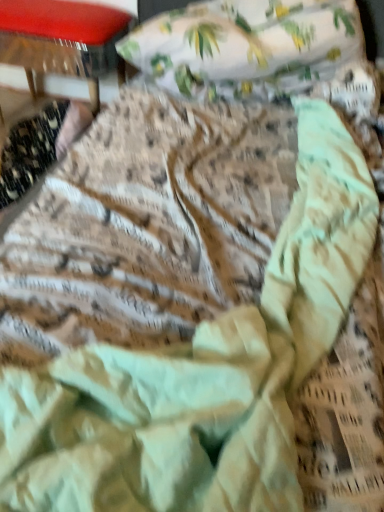
Describe the element at coordinates (61, 36) in the screenshot. Image resolution: width=384 pixels, height=512 pixels. I see `wooden table at upper left` at that location.

At what (x,y) coordinates should I click in order to perform the action: click on wooden table at upper left. Please return your answer as a coordinate pair (x, y). Image resolution: width=384 pixels, height=512 pixels. Looking at the image, I should click on (61, 36).

Find the location of `wooden table at upper left`. wooden table at upper left is located at coordinates (61, 36).